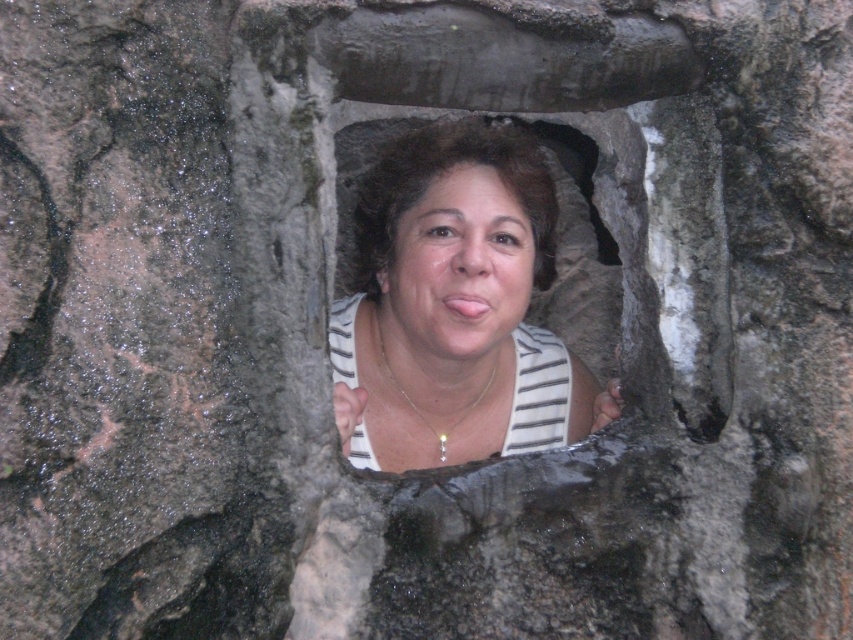
You are an artist trying to sketch the scene. You notice the two central elements, the matte white tank top at center and the matte white face at center. Which one should you draw first if you want to follow the rule of starting with the larger elements first?

The matte white tank top at center has a greater height compared to the matte white face at center, so you should draw the matte white tank top at center first.

You are an architect designing a new sculpture that requires knowing the spatial relationship between the matte white tank top at center and the matte white face at center in the image. Which object is closer to the viewer?

The matte white tank top at center is in front of the matte white face at center, so it is closer to the viewer.

You are standing in front of a stone structure with two points marked. The first point is at coordinates point (x=402, y=320) and the second point is at point (x=430, y=339). Which point is closer to you?

Point (x=402, y=320) is further to the viewer than point (x=430, y=339), so the second point is closer to you.